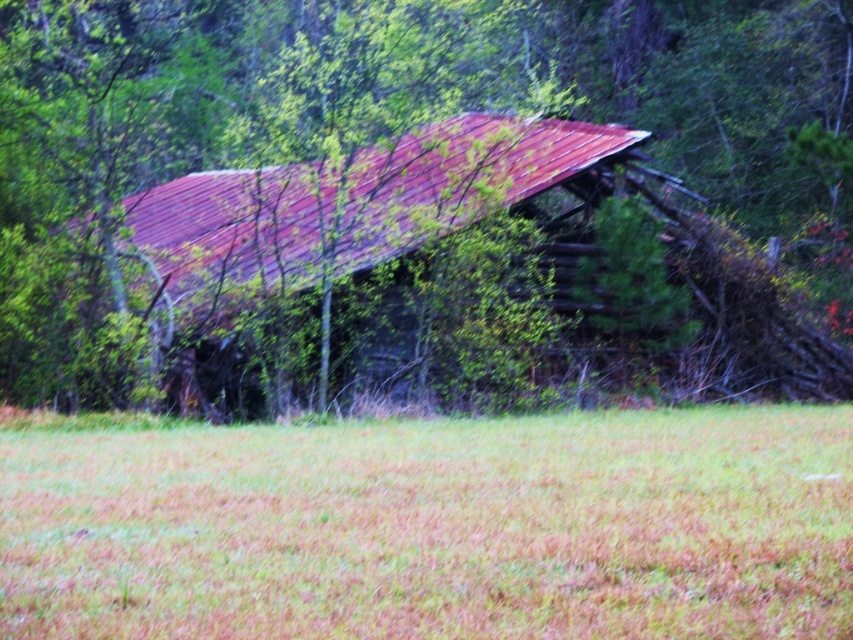
Question: Among these objects, which one is farthest from the camera?

Choices:
 (A) brown dry grass at center
 (B) rusty metal roof at center

Answer: (B)

Question: Among these objects, which one is farthest from the camera?

Choices:
 (A) rusty metal roof at center
 (B) brown dry grass at center

Answer: (A)

Question: Does rusty metal roof at center have a lesser width compared to brown dry grass at center?

Choices:
 (A) yes
 (B) no

Answer: (B)

Question: Is rusty metal roof at center closer to the viewer compared to brown dry grass at center?

Choices:
 (A) yes
 (B) no

Answer: (B)

Question: Is rusty metal roof at center smaller than brown dry grass at center?

Choices:
 (A) yes
 (B) no

Answer: (B)